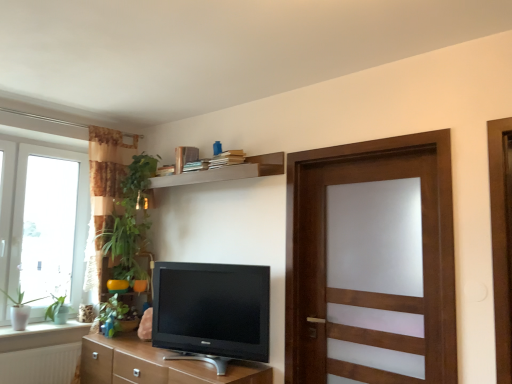
Question: From the image's perspective, is brown wood cabinet at lower center located above or below wooden shelf at upper center?

Choices:
 (A) above
 (B) below

Answer: (B)

Question: Considering their positions, is brown wood cabinet at lower center located in front of or behind wooden shelf at upper center?

Choices:
 (A) behind
 (B) front

Answer: (B)

Question: Which of these objects is positioned closest to the white glass window at left?

Choices:
 (A) wooden shelf at upper center
 (B) matte black tv at center
 (C) green matte plant at lower left, placed as the 2th plant when sorted from right to left
 (D) green matte plant at left, marked as the 3th plant in a right-to-left arrangement
 (E) wooden door at right

Answer: (D)

Question: Estimate the real-world distances between objects in this image. Which object is closer to the matte black tv at center?

Choices:
 (A) white ceramic window sill at lower left
 (B) green leafy plant at left, arranged as the first plant when viewed from the right
 (C) green matte plant at left, marked as the 3th plant in a right-to-left arrangement
 (D) white glass window at left
 (E) brown wood cabinet at lower center

Answer: (E)